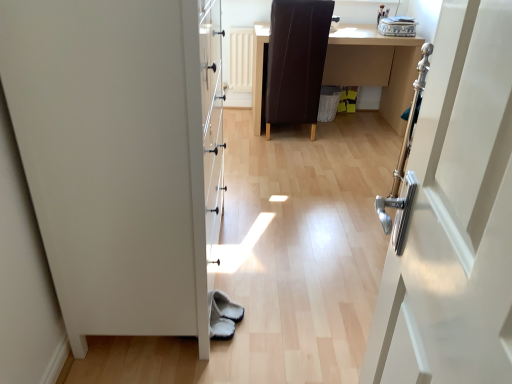
Question: From a real-world perspective, is brown leather desk at center located higher than brown leather chair at center?

Choices:
 (A) yes
 (B) no

Answer: (B)

Question: Can you confirm if brown leather desk at center is bigger than brown leather chair at center?

Choices:
 (A) yes
 (B) no

Answer: (A)

Question: Is brown leather desk at center at the left side of brown leather chair at center?

Choices:
 (A) no
 (B) yes

Answer: (A)

Question: Does brown leather desk at center have a smaller size compared to brown leather chair at center?

Choices:
 (A) no
 (B) yes

Answer: (A)

Question: From the image's perspective, does brown leather desk at center appear lower than brown leather chair at center?

Choices:
 (A) no
 (B) yes

Answer: (B)

Question: Considering the positions of point (268, 125) and point (54, 41), is point (268, 125) closer or farther from the camera than point (54, 41)?

Choices:
 (A) farther
 (B) closer

Answer: (A)

Question: From their relative heights in the image, would you say brown leather chair at center is taller or shorter than white matte door at left?

Choices:
 (A) tall
 (B) short

Answer: (B)

Question: From a real-world perspective, relative to white matte door at left, is brown leather chair at center vertically above or below?

Choices:
 (A) above
 (B) below

Answer: (B)

Question: In the image, is brown leather chair at center positioned in front of or behind white matte door at left?

Choices:
 (A) behind
 (B) front

Answer: (A)

Question: Considering the positions of brown leather desk at center and white matte door at left in the image, is brown leather desk at center bigger or smaller than white matte door at left?

Choices:
 (A) small
 (B) big

Answer: (A)

Question: From their relative heights in the image, would you say brown leather desk at center is taller or shorter than white matte door at left?

Choices:
 (A) short
 (B) tall

Answer: (A)

Question: Would you say brown leather desk at center is to the left or to the right of white matte door at left in the picture?

Choices:
 (A) right
 (B) left

Answer: (A)

Question: Relative to white matte door at left, is brown leather desk at center in front or behind?

Choices:
 (A) behind
 (B) front

Answer: (A)

Question: From a real-world perspective, is brown leather chair at center physically located above or below brown leather desk at center?

Choices:
 (A) above
 (B) below

Answer: (A)

Question: From the image's perspective, is brown leather chair at center located above or below brown leather desk at center?

Choices:
 (A) above
 (B) below

Answer: (A)